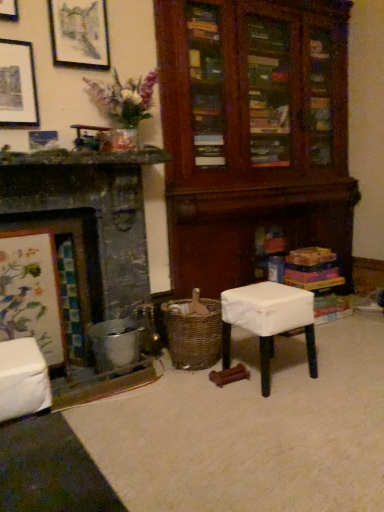
What are the coordinates of `free space to the right of metallic silver fireplace at left` in the screenshot? It's located at (197, 403).